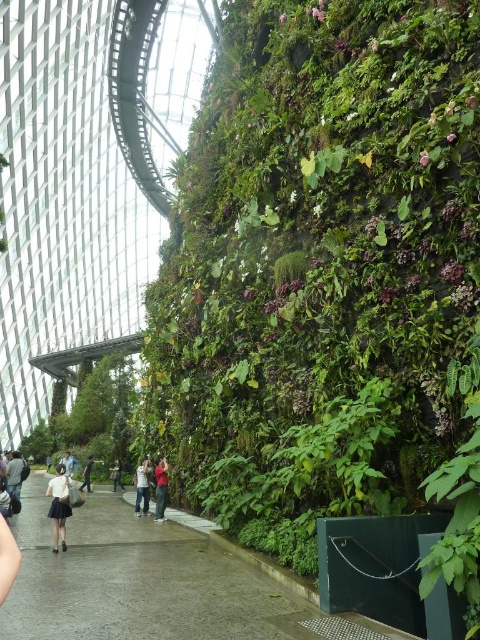
Question: Is concrete pavement at center thinner than white matte skirt at lower left?

Choices:
 (A) yes
 (B) no

Answer: (B)

Question: Considering the real-world distances, which object is closest to the green leafy wall at center?

Choices:
 (A) white cotton shirt at center
 (B) concrete pavement at center
 (C) white matte skirt at lower left

Answer: (B)

Question: Which point is farther from the camera taking this photo?

Choices:
 (A) click(x=59, y=512)
 (B) click(x=85, y=474)
 (C) click(x=136, y=502)

Answer: (B)

Question: Which object is positioned closest to the dark blue jeans at center?

Choices:
 (A) concrete pavement at center
 (B) white cotton shirt at center
 (C) white matte skirt at lower left
 (D) white fabric bag at lower center

Answer: (D)

Question: Does white cotton shirt at center appear on the left side of dark blue jeans at center?

Choices:
 (A) yes
 (B) no

Answer: (B)

Question: Observing the image, what is the correct spatial positioning of white matte skirt at lower left in reference to matte red shirt at center?

Choices:
 (A) right
 (B) left

Answer: (B)